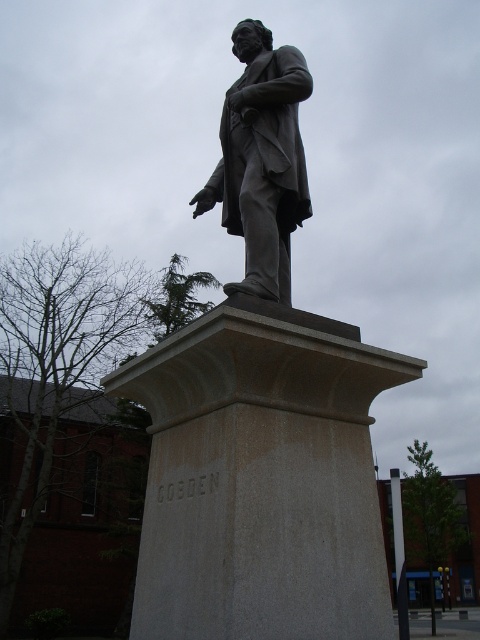
Image resolution: width=480 pixels, height=640 pixels. What do you see at coordinates (261, 413) in the screenshot?
I see `gray polished stone statue at center` at bounding box center [261, 413].

Which is below, gray polished stone statue at center or bronze statue at center?

gray polished stone statue at center

I want to click on gray polished stone statue at center, so tap(261, 413).